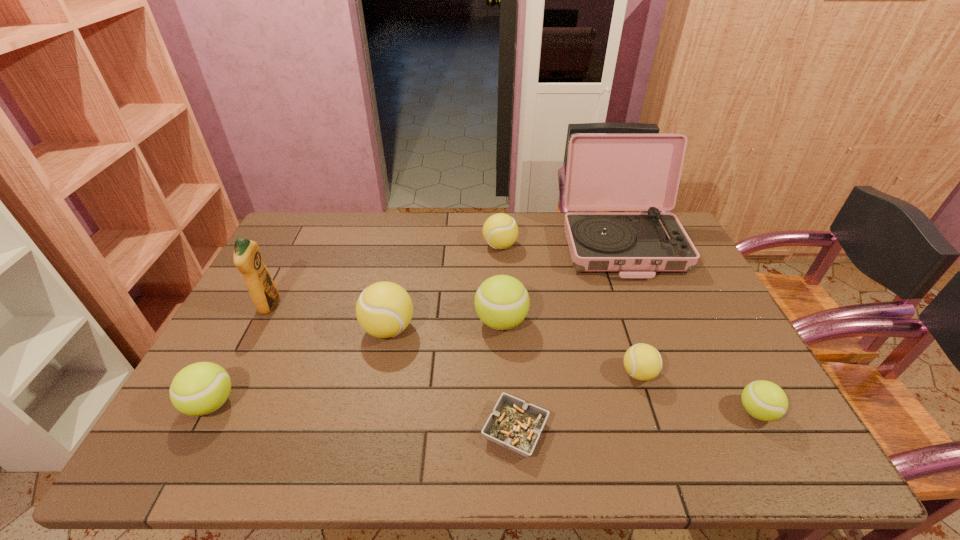
Image resolution: width=960 pixels, height=540 pixels. I want to click on record player, so click(x=605, y=171).

This screenshot has width=960, height=540. Find the location of `the eighth shortest object`. the eighth shortest object is located at coordinates (263, 291).

You are a GUI agent. You are given a task and a screenshot of the screen. Output one action in this format:
    pyautogui.click(x=<x>, y=<y>)
    Task: Click on the third object from left to right
    This screenshot has width=960, height=540.
    Given the screenshot: What is the action you would take?
    pyautogui.click(x=384, y=309)

Identify the location of the leftmost yellow tennis ball. (384, 309).

Where is `the biggest green tennis ball`? The width and height of the screenshot is (960, 540). the biggest green tennis ball is located at coordinates (501, 302).

Where is `the farthest green tennis ball`? the farthest green tennis ball is located at coordinates (501, 302).

The width and height of the screenshot is (960, 540). In order to click on the farthest tennis ball in this screenshot , I will do `click(500, 231)`.

Find the location of a particular element. The width and height of the screenshot is (960, 540). the farthest yellow tennis ball is located at coordinates (500, 231).

Locate an element on the screen. Image resolution: width=960 pixels, height=540 pixels. the leftmost tennis ball is located at coordinates (201, 388).

You are a GUI agent. You are given a task and a screenshot of the screen. Output one action in this format:
    pyautogui.click(x=<x>, y=<y>)
    Task: Click on the leftmost green tennis ball
    This screenshot has width=960, height=540.
    Given the screenshot: What is the action you would take?
    click(x=201, y=388)